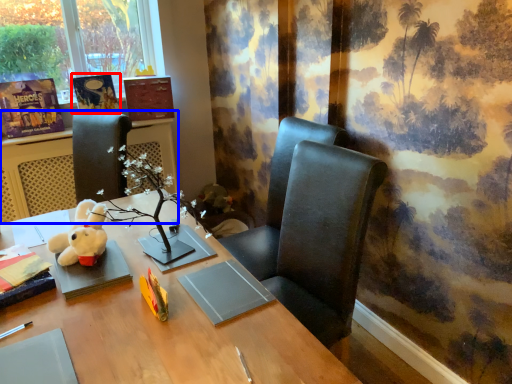
Question: Among these objects, which one is farthest to the camera, book (highlighted by a red box) or table (highlighted by a blue box)?

Choices:
 (A) book
 (B) table

Answer: (A)